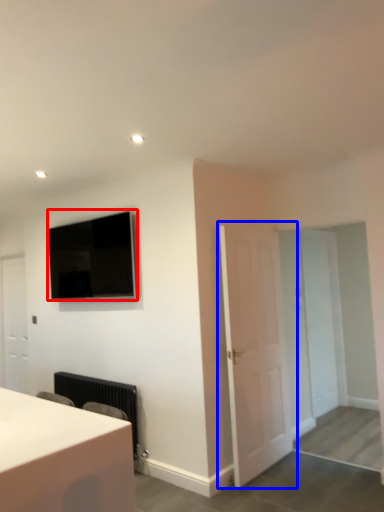
Question: Which object appears closest to the camera in this image, television (highlighted by a red box) or door (highlighted by a blue box)?

Choices:
 (A) television
 (B) door

Answer: (B)